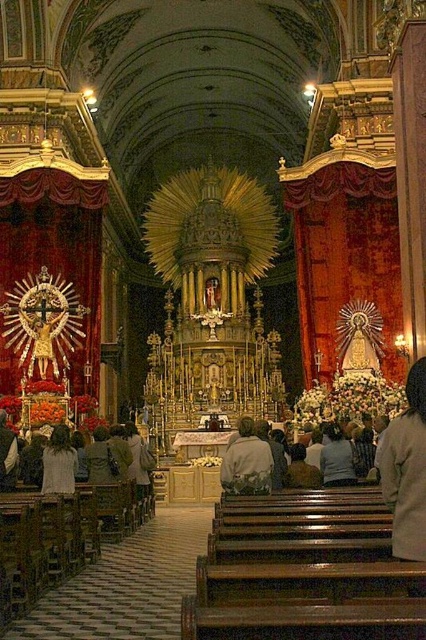
Between light beige coat at lower right and light beige jacket at center, which one is positioned lower?

light beige jacket at center is below.

Who is positioned more to the left, light beige coat at lower right or light beige jacket at center?

light beige jacket at center is more to the left.

Measure the distance between point (408, 378) and camera.

38.23 meters

Identify the location of light beige coat at lower right. The height and width of the screenshot is (640, 426). (406, 468).